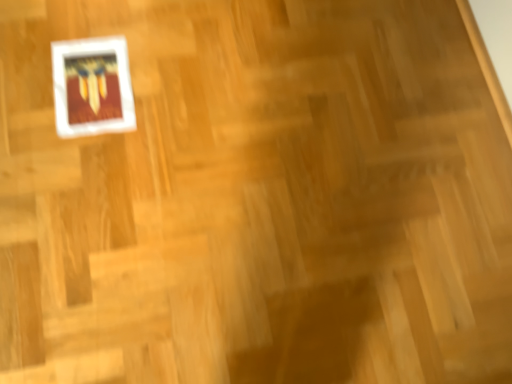
This screenshot has height=384, width=512. I want to click on free point above white glossy picture frame at upper left (from a real-world perspective), so click(96, 85).